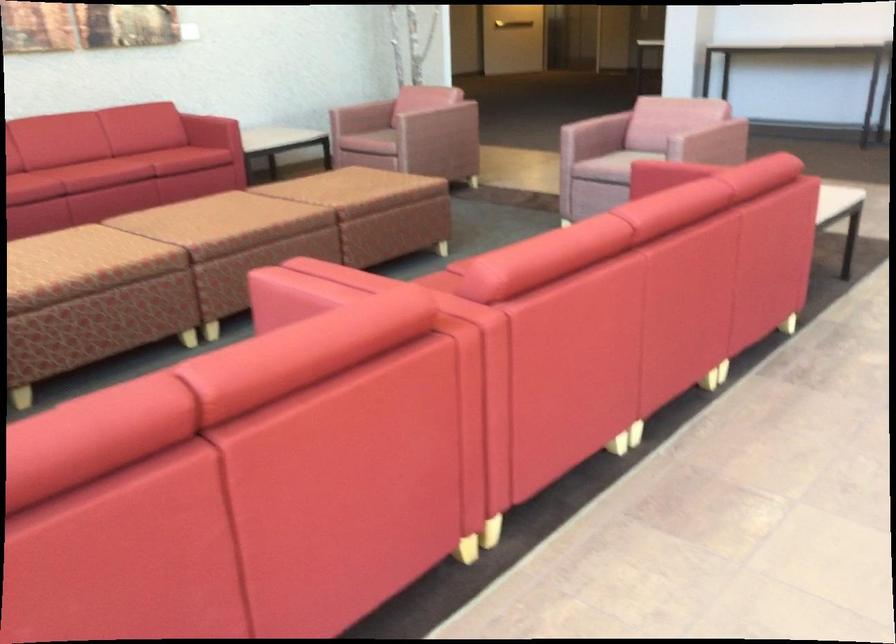
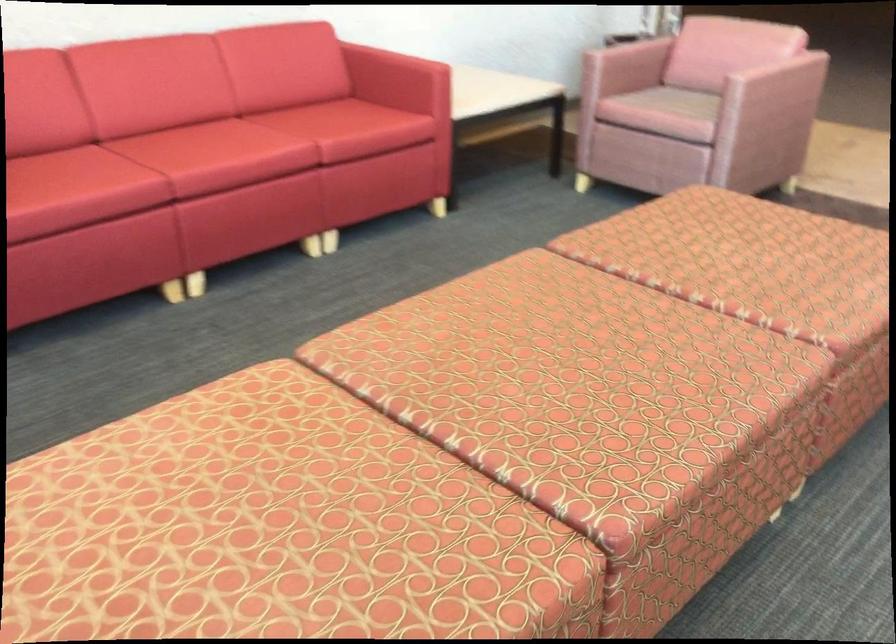
Locate, in the second image, the point that corresponds to (x=73, y=245) in the first image.

(250, 522)